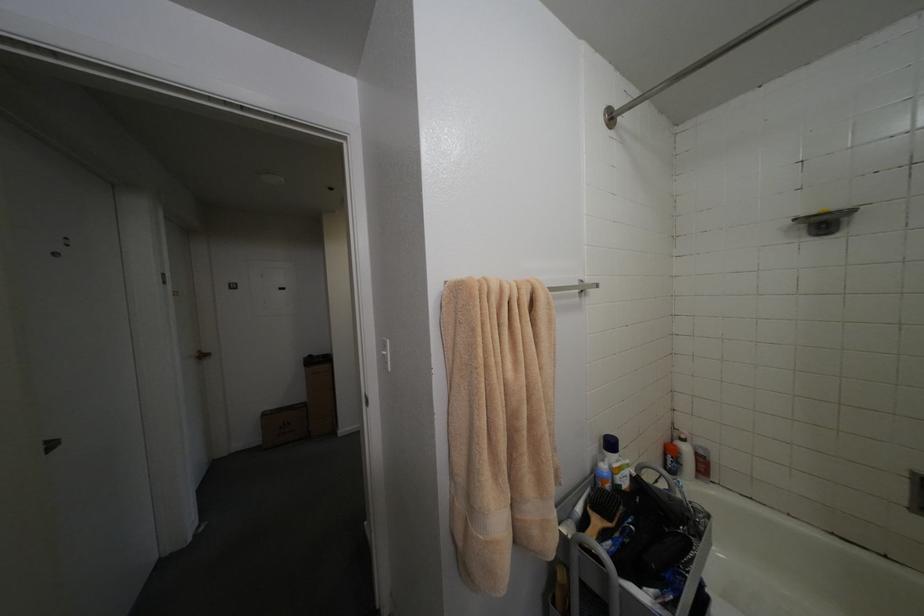
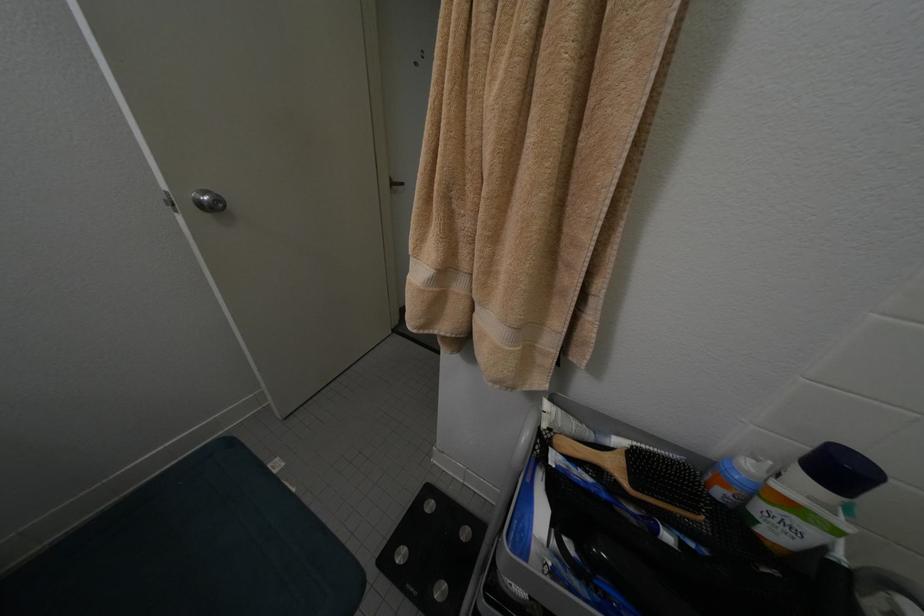
The first image is from the beginning of the video and the second image is from the end. How did the camera likely rotate when shooting the video?

The camera's rotation is toward left-down.